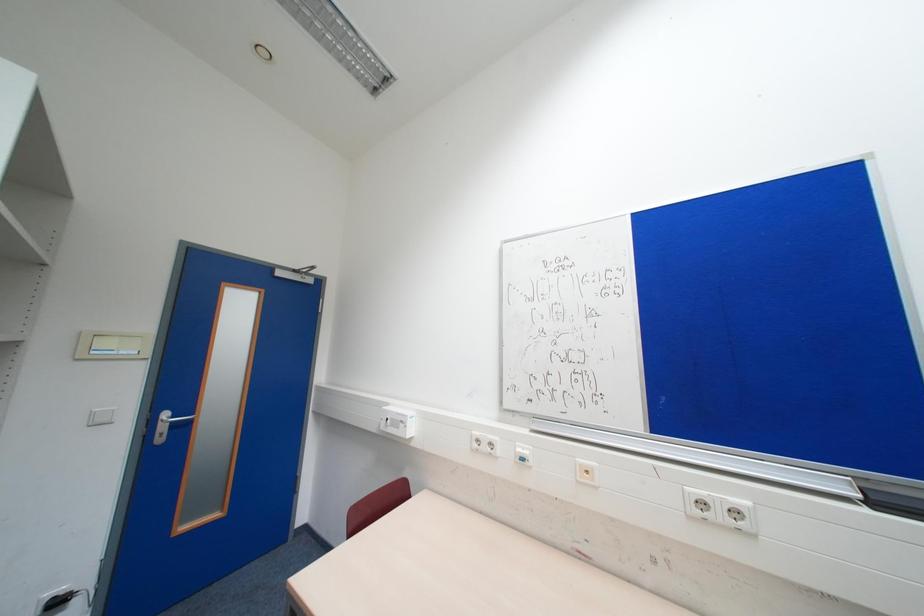
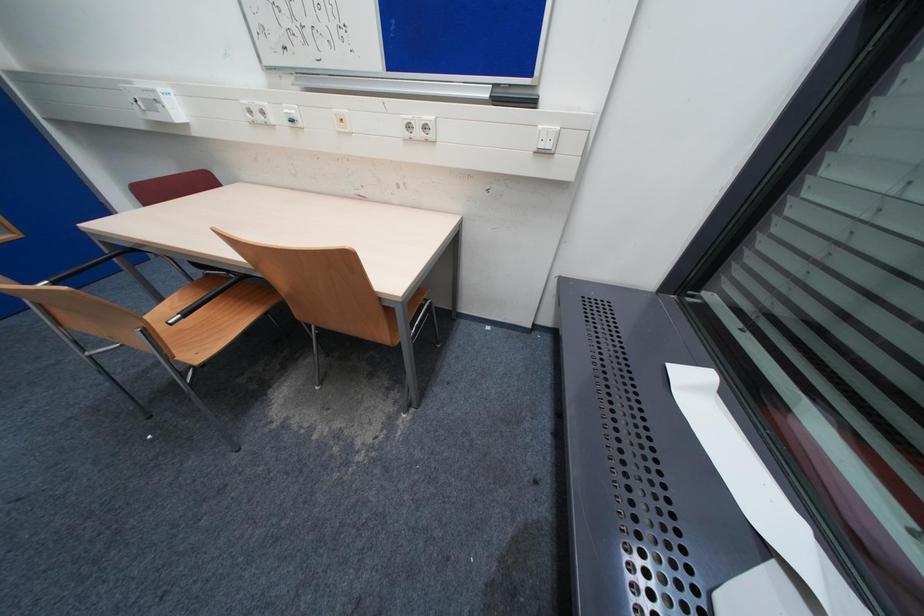
First-person continuous shooting, in which direction is the camera rotating?

The camera rotated toward right-down.